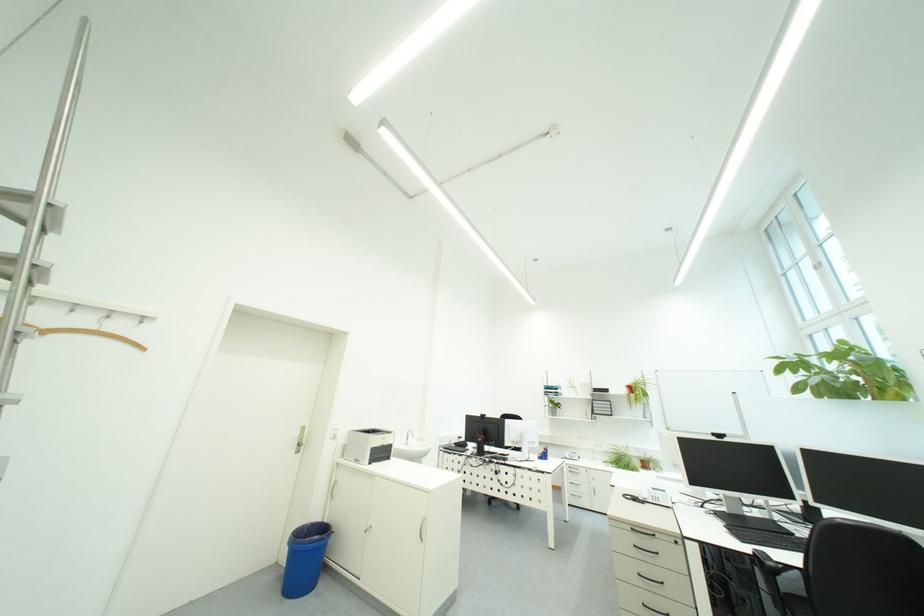
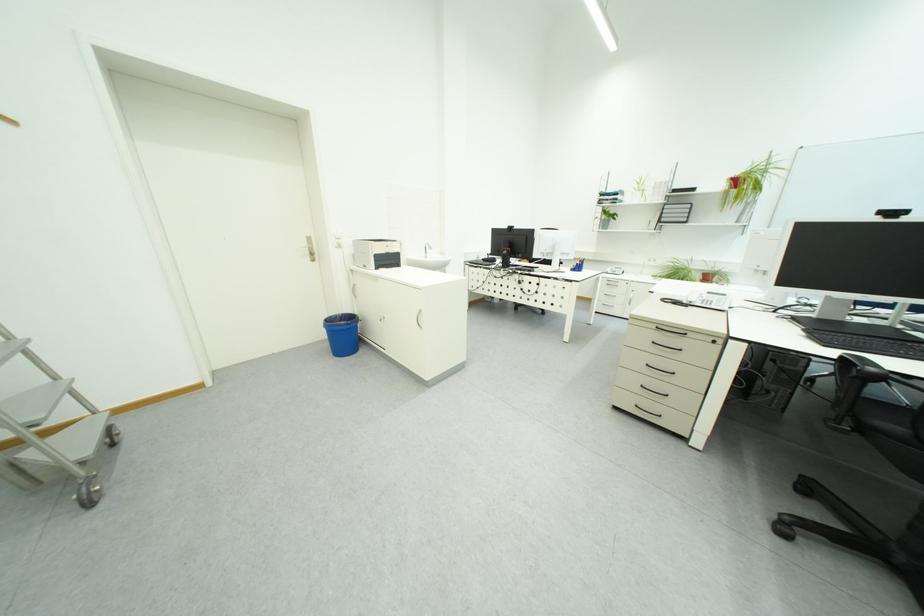
Find the pixel in the second image that matches point 321,559 in the first image.

(358, 336)